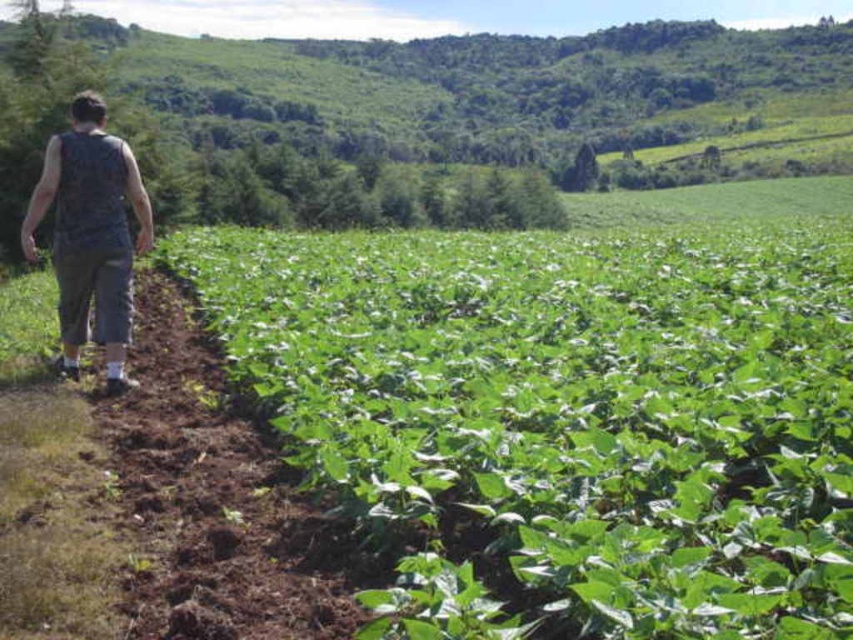
Measure the distance between green leafy plant at center and camera.

A distance of 8.19 feet exists between green leafy plant at center and camera.

Which is behind, point (329, 474) or point (544, 124)?

Point (544, 124)

In the scene shown: Who is more distant from viewer, (x=257, y=282) or (x=634, y=86)?

Point (x=634, y=86)

Find the location of a particular element. The width and height of the screenshot is (853, 640). green leafy plant at center is located at coordinates (563, 417).

Does green leafy hillside at upper left have a greater height compared to dark gray sleeveless shirt at left?

Correct, green leafy hillside at upper left is much taller as dark gray sleeveless shirt at left.

Describe the element at coordinates (485, 88) in the screenshot. I see `green leafy hillside at upper left` at that location.

Locate an element on the screen. green leafy hillside at upper left is located at coordinates (485, 88).

Locate an element on the screen. This screenshot has width=853, height=640. green leafy hillside at upper left is located at coordinates (485, 88).

Does green leafy plant at center come behind dark gray sleeveless shirt at left?

That is False.

Does point (799, 547) come in front of point (82, 260)?

Yes, it is in front of point (82, 260).

The width and height of the screenshot is (853, 640). What are the coordinates of `green leafy plant at center` in the screenshot? It's located at (563, 417).